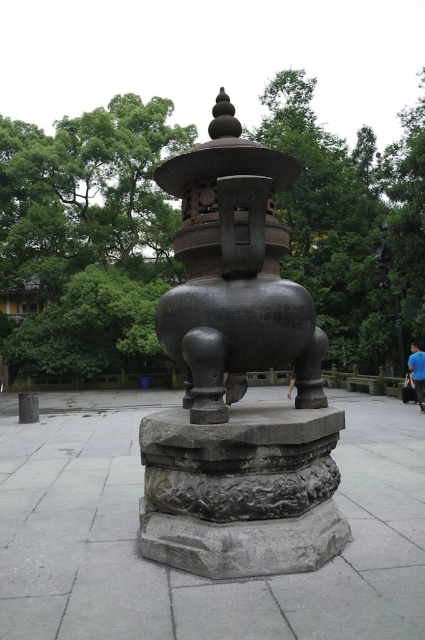
You are standing next to the blue fabric person at lower right and want to place a 10 meter long banner from your current position to the bronze textured censer at center. Is the banner long enough?

The distance between the blue fabric person at lower right and the bronze textured censer at center is 12.39 meters. Since the banner is only 10 meters long, it is not long enough to reach from the blue fabric person at lower right to the bronze textured censer at center.

You are standing at the entrance of the park and see the bronze textured censer at center and the blue fabric person at lower right. Which object is closer to your left side?

The bronze textured censer at center is positioned on the left side of blue fabric person at lower right, so it would be closer to your left side.